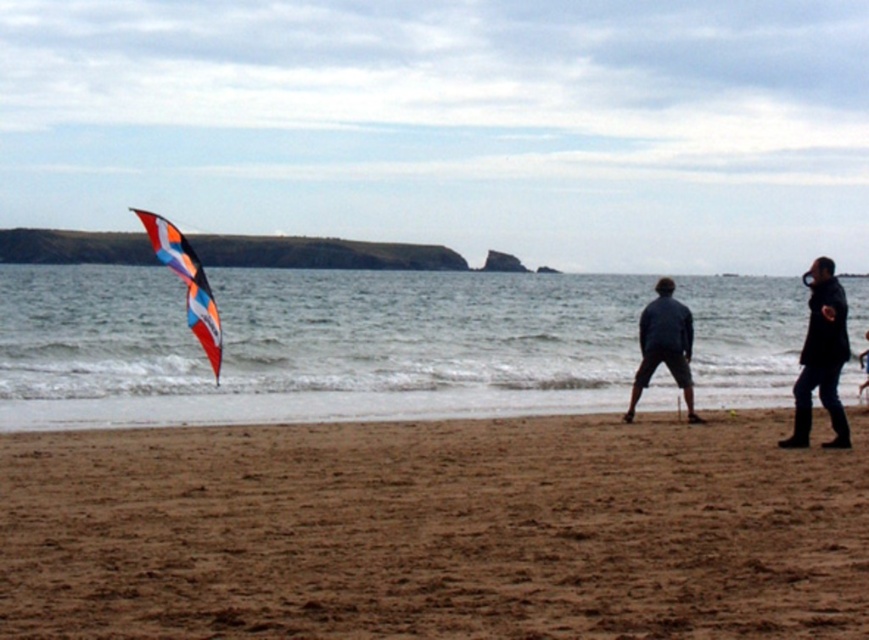
Between point (585, 556) and point (667, 323), which one is positioned in front?

Positioned in front is point (585, 556).

Who is positioned more to the left, brown sandy beach at lower center or dark blue denim shorts at center?

brown sandy beach at lower center

Locate an element on the screen. brown sandy beach at lower center is located at coordinates (435, 531).

Who is positioned more to the right, translucent kite at center or black leather jacket at right?

From the viewer's perspective, black leather jacket at right appears more on the right side.

Between point (290, 323) and point (831, 369), which one is positioned behind?

The point (290, 323) is behind.

Image resolution: width=869 pixels, height=640 pixels. What are the coordinates of `translucent kite at center` in the screenshot? It's located at (310, 346).

Image resolution: width=869 pixels, height=640 pixels. Identify the location of brown sandy beach at lower center. (435, 531).

The height and width of the screenshot is (640, 869). I want to click on brown sandy beach at lower center, so click(x=435, y=531).